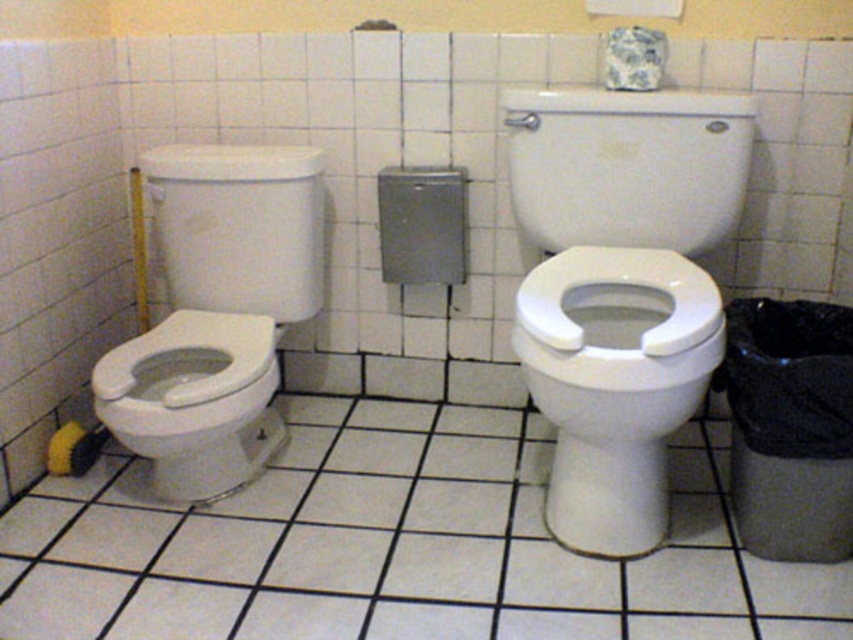
Question: Which point is closer to the camera?

Choices:
 (A) white glossy toilet lid at upper center
 (B) white glossy toilet at upper center
 (C) yellow fabric toilet paper at lower left

Answer: (B)

Question: Is white glossy toilet at left wider than yellow fabric toilet paper at lower left?

Choices:
 (A) yes
 (B) no

Answer: (A)

Question: Where is white glossy toilet at left located in relation to yellow fabric toilet paper at lower left in the image?

Choices:
 (A) below
 (B) above

Answer: (B)

Question: Does white glossy toilet at upper center have a larger size compared to yellow fabric toilet paper at lower left?

Choices:
 (A) yes
 (B) no

Answer: (A)

Question: Among these points, which one is nearest to the camera?

Choices:
 (A) (668, 180)
 (B) (45, 467)
 (C) (636, 36)
 (D) (183, 173)

Answer: (C)

Question: Which object is closer to the camera taking this photo?

Choices:
 (A) white glossy toilet at upper center
 (B) white glossy toilet lid at upper center
 (C) yellow fabric toilet paper at lower left

Answer: (A)